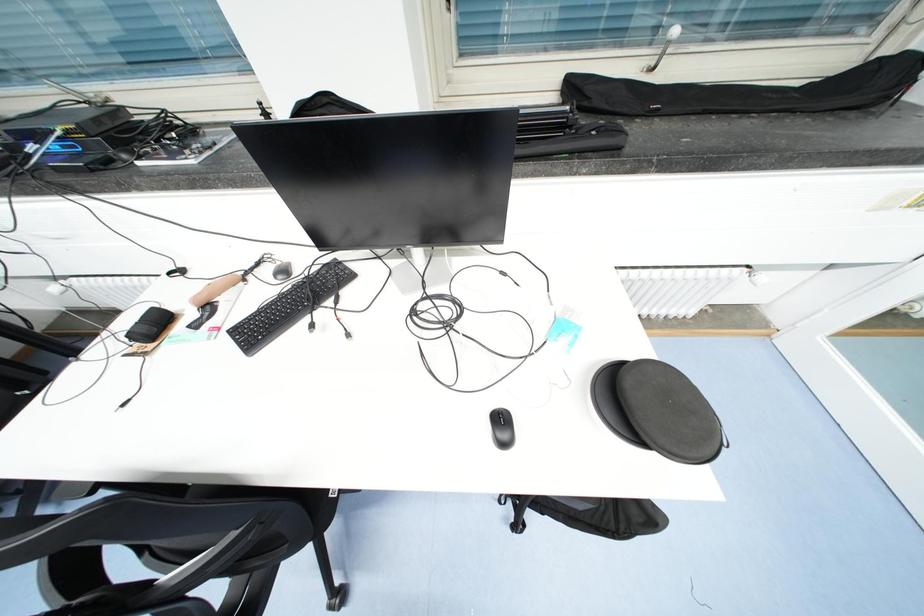
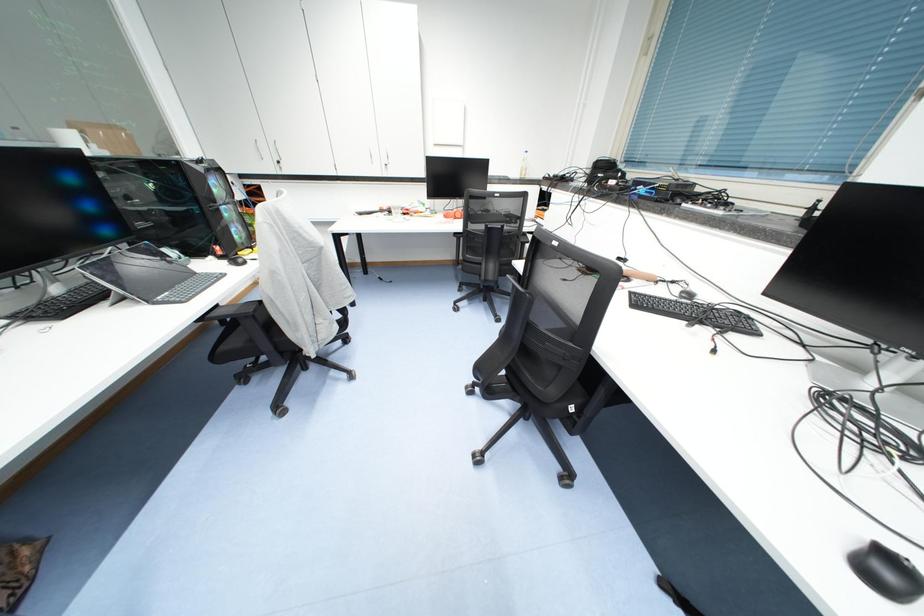
Question: The images are taken continuously from a first-person perspective. In which direction is your viewpoint rotating?

Choices:
 (A) Left
 (B) Right
 (C) Up
 (D) Down

Answer: (A)